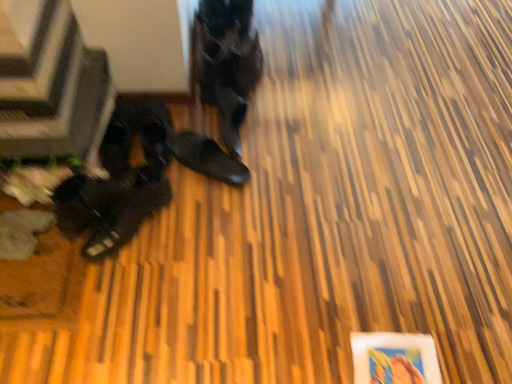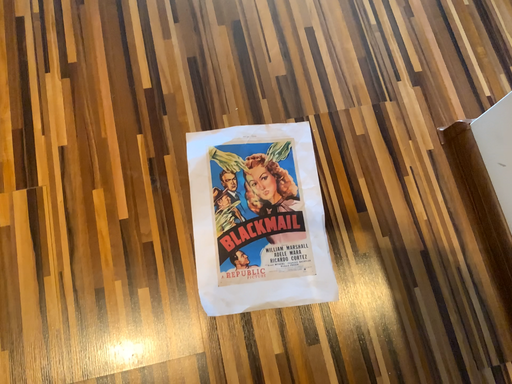
Question: How did the camera likely rotate when shooting the video?

Choices:
 (A) rotated downward
 (B) rotated upward

Answer: (A)